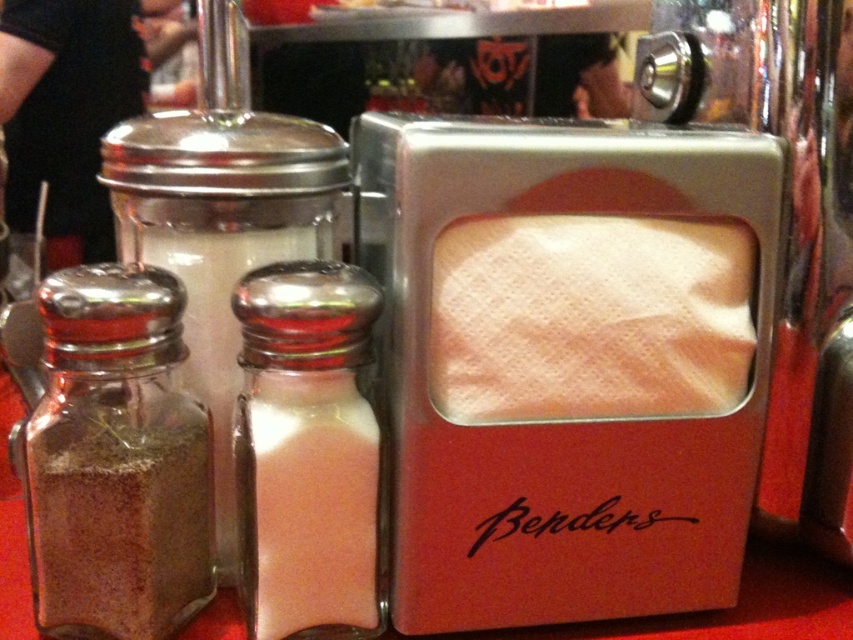
Does brown powder at left have a greater height compared to pink glass salt shaker at center?

No.

Between point (80, 621) and point (363, 355), which one is positioned behind?

Point (80, 621)

Find the location of `brown powder at left`. brown powder at left is located at coordinates (117, 460).

Locate an element on the screen. brown powder at left is located at coordinates (117, 460).

Between white paper napkin at center and pink glass salt shaker at center, which one has less height?

Standing shorter between the two is white paper napkin at center.

Does white paper napkin at center have a greater width compared to pink glass salt shaker at center?

Yes.

Find the location of a particular element. This screenshot has height=640, width=853. white paper napkin at center is located at coordinates [x=589, y=317].

This screenshot has width=853, height=640. Find the location of `white paper napkin at center`. white paper napkin at center is located at coordinates (589, 317).

How distant is white paper napkin at center from brown powder at left?

They are 6.75 inches apart.

Does point (585, 253) come in front of point (173, 362)?

Yes, point (585, 253) is in front of point (173, 362).

The image size is (853, 640). Find the location of `white paper napkin at center`. white paper napkin at center is located at coordinates (589, 317).

Identify the location of white paper napkin at center. The width and height of the screenshot is (853, 640). (589, 317).